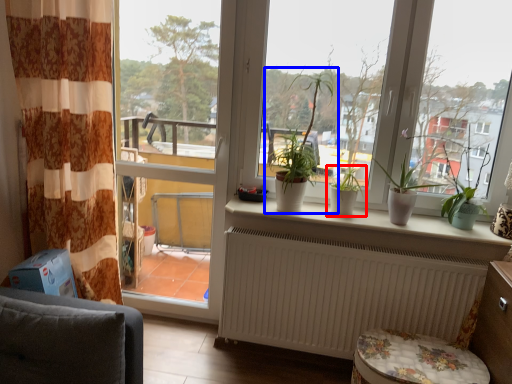
Question: Which object appears closest to the camera in this image, houseplant (highlighted by a red box) or houseplant (highlighted by a blue box)?

Choices:
 (A) houseplant
 (B) houseplant

Answer: (B)